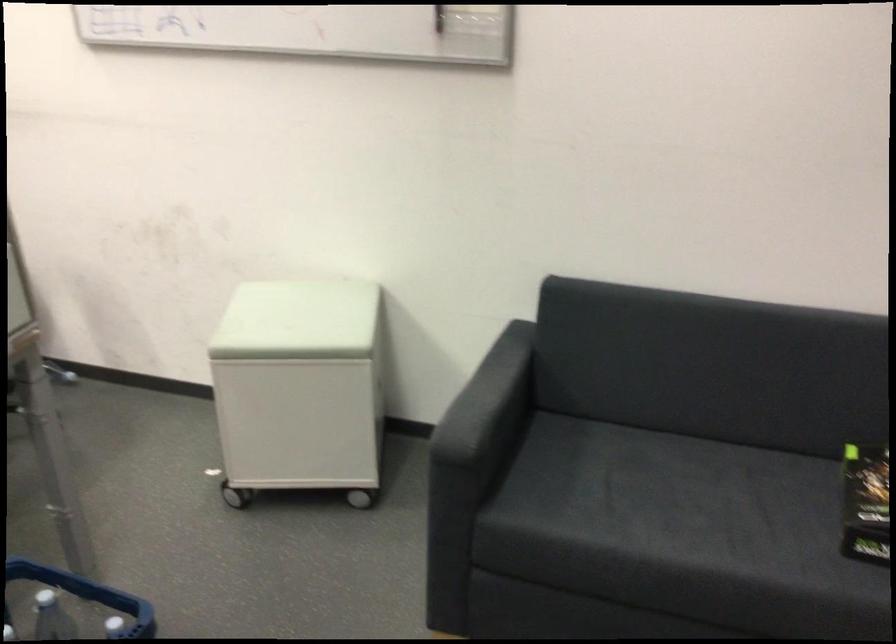
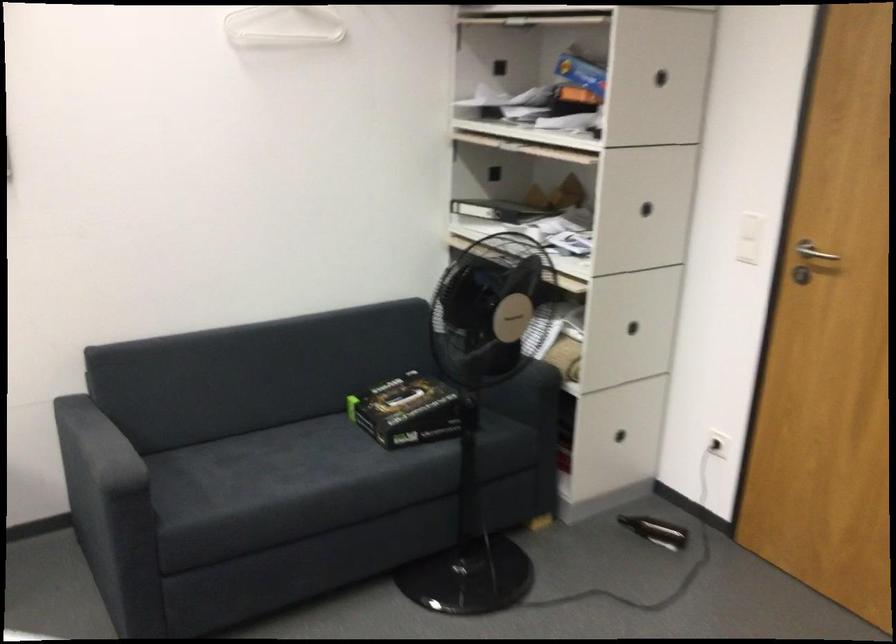
In the second image, find the point that corresponds to the point at 487,381 in the first image.

(93, 440)